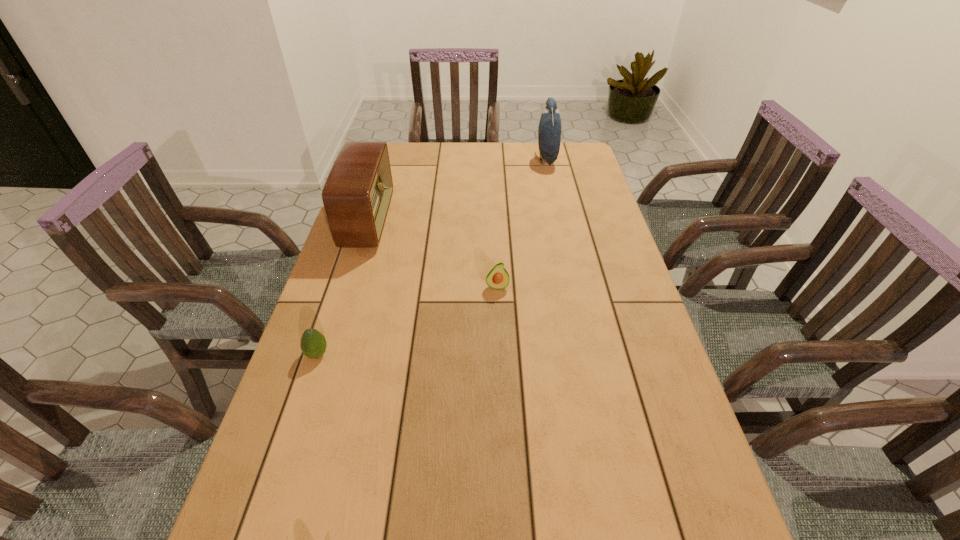
Where is `the rightmost object`? Image resolution: width=960 pixels, height=540 pixels. the rightmost object is located at coordinates (549, 130).

Identify the location of the farthest object. Image resolution: width=960 pixels, height=540 pixels. (549, 130).

At what (x,y) coordinates should I click in order to perform the action: click on the second farthest object. Please return your answer as a coordinate pair (x, y). Looking at the image, I should click on click(x=357, y=194).

Where is `the right avocado`? The width and height of the screenshot is (960, 540). the right avocado is located at coordinates (498, 278).

The height and width of the screenshot is (540, 960). Identify the location of the second nearest object. (498, 278).

You are a GUI agent. You are given a task and a screenshot of the screen. Output one action in this format:
    pyautogui.click(x=<x>, y=<y>)
    Task: Click on the nearest object
    This screenshot has width=960, height=540.
    Given the screenshot: What is the action you would take?
    pyautogui.click(x=313, y=344)

Where is `the left avocado`? Image resolution: width=960 pixels, height=540 pixels. the left avocado is located at coordinates (313, 344).

Where is `free spot located at the tip of the farthest object's beak`? The image size is (960, 540). free spot located at the tip of the farthest object's beak is located at coordinates (468, 160).

This screenshot has width=960, height=540. Identify the location of free spot located at the tip of the farthest object's beak. (510, 160).

Find the location of a particular element. This screenshot has width=960, height=540. vacant position located at the tip of the farthest object's beak is located at coordinates (458, 160).